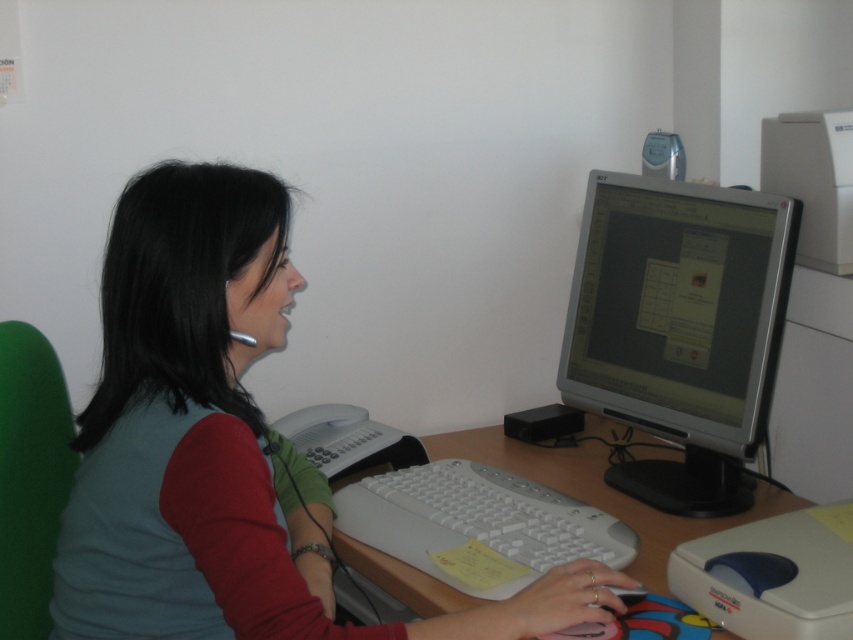
You are setting up a new workstation and want to place the white plastic keyboard at center on the left side of the white plastic computer desk at center. Does the current arrangement match your desired setup?

Yes, the white plastic keyboard at center is already placed to the left of the white plastic computer desk at center, matching your desired setup.

You are an office worker who needs to reach a file located at point [474,568] and a calculator at point [610,461]. Which object is closer to you?

Point [474,568] is in front of point [610,461], so the file located at point [474,568] is closer to you.